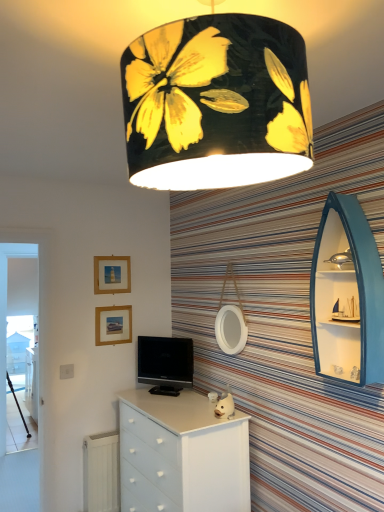
Question: Is matte gold picture frame at upper left, placed as the 2th picture frame when sorted from bottom to top, beside white glossy chest of drawers at center?

Choices:
 (A) yes
 (B) no

Answer: (B)

Question: Is matte gold picture frame at upper left, placed as the 2th picture frame when sorted from bottom to top, not inside white glossy chest of drawers at center?

Choices:
 (A) no
 (B) yes

Answer: (B)

Question: Does matte gold picture frame at upper left, the first picture frame in the top-to-bottom sequence, have a lesser height compared to white glossy chest of drawers at center?

Choices:
 (A) yes
 (B) no

Answer: (A)

Question: From a real-world perspective, is matte gold picture frame at upper left, placed as the 2th picture frame when sorted from bottom to top, on top of white glossy chest of drawers at center?

Choices:
 (A) yes
 (B) no

Answer: (A)

Question: Would you say matte gold picture frame at upper left, the first picture frame in the top-to-bottom sequence, contains white glossy chest of drawers at center?

Choices:
 (A) no
 (B) yes

Answer: (A)

Question: Is matte gold picture frame at upper left, placed as the 2th picture frame when sorted from bottom to top, oriented away from white glossy chest of drawers at center?

Choices:
 (A) yes
 (B) no

Answer: (B)

Question: Would you say wooden tripod at left is outside teal wood boat-shaped shelf at right?

Choices:
 (A) no
 (B) yes

Answer: (B)

Question: From a real-world perspective, is wooden tripod at left under teal wood boat-shaped shelf at right?

Choices:
 (A) no
 (B) yes

Answer: (B)

Question: Can you confirm if wooden tripod at left is bigger than teal wood boat-shaped shelf at right?

Choices:
 (A) yes
 (B) no

Answer: (B)

Question: Is wooden tripod at left surrounding teal wood boat-shaped shelf at right?

Choices:
 (A) no
 (B) yes

Answer: (A)

Question: Does wooden tripod at left lie in front of teal wood boat-shaped shelf at right?

Choices:
 (A) yes
 (B) no

Answer: (B)

Question: From the image's perspective, does wooden tripod at left appear lower than teal wood boat-shaped shelf at right?

Choices:
 (A) yes
 (B) no

Answer: (A)

Question: Is white glossy chest of drawers at center shorter than matte gold picture frame at upper left, placed as the 2th picture frame when sorted from bottom to top?

Choices:
 (A) yes
 (B) no

Answer: (B)